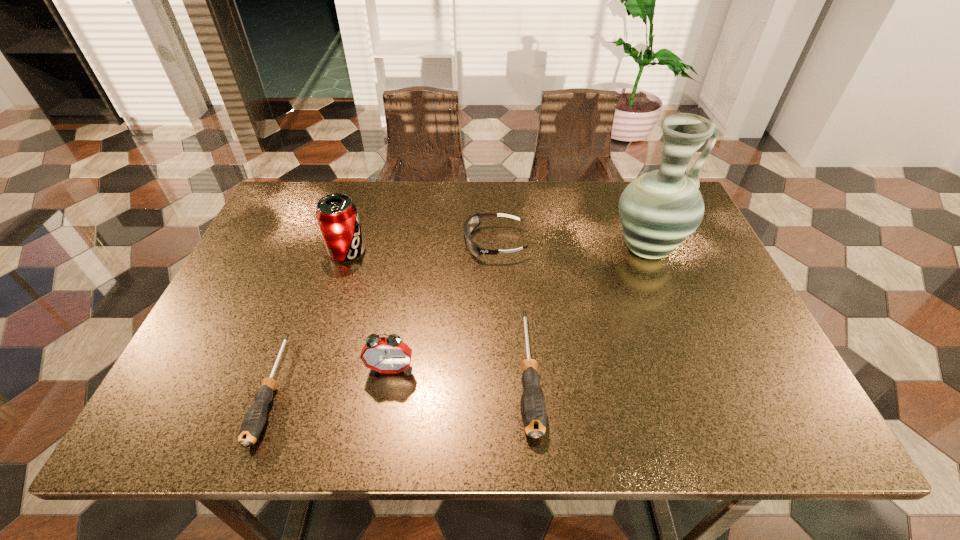
Where is `free location located 0.350m on the back of the shorter screwdriver`? free location located 0.350m on the back of the shorter screwdriver is located at coordinates (329, 237).

This screenshot has height=540, width=960. In order to click on vacant position located on the back of the taller screwdriver in this screenshot , I will do `click(516, 243)`.

Where is `vacant space located 0.300m on the front and sides of the goggles`? This screenshot has height=540, width=960. vacant space located 0.300m on the front and sides of the goggles is located at coordinates (353, 242).

In order to click on blank space located 0.390m on the front and sides of the goggles in this screenshot , I will do `click(321, 242)`.

Locate an element on the screen. This screenshot has height=540, width=960. vacant region located 0.330m on the front and sides of the goggles is located at coordinates (343, 242).

You are a GUI agent. You are given a task and a screenshot of the screen. Output one action in this format:
    pyautogui.click(x=<x>, y=<y>)
    Task: Click on the free space located on the left of the soda can
    
    Given the screenshot: What is the action you would take?
    pyautogui.click(x=276, y=251)

Where is `pitcher at the far edge`? This screenshot has width=960, height=540. pitcher at the far edge is located at coordinates (658, 210).

This screenshot has height=540, width=960. I want to click on goggles present at the far edge, so click(x=472, y=222).

Locate an element on the screen. alarm clock located in the near edge section of the desktop is located at coordinates (390, 354).

The height and width of the screenshot is (540, 960). Identify the location of object positioned at the right edge. (658, 210).